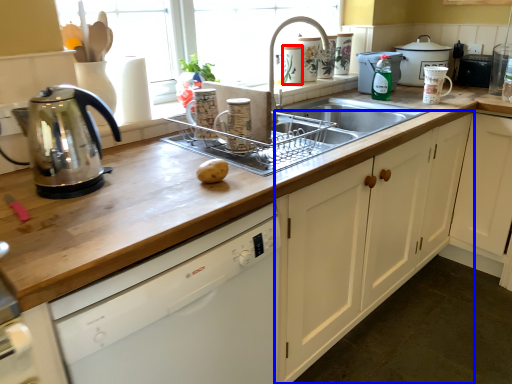
Question: Which point is further to the camera, appliance (highlighted by a red box) or cabinetry (highlighted by a blue box)?

Choices:
 (A) appliance
 (B) cabinetry

Answer: (A)